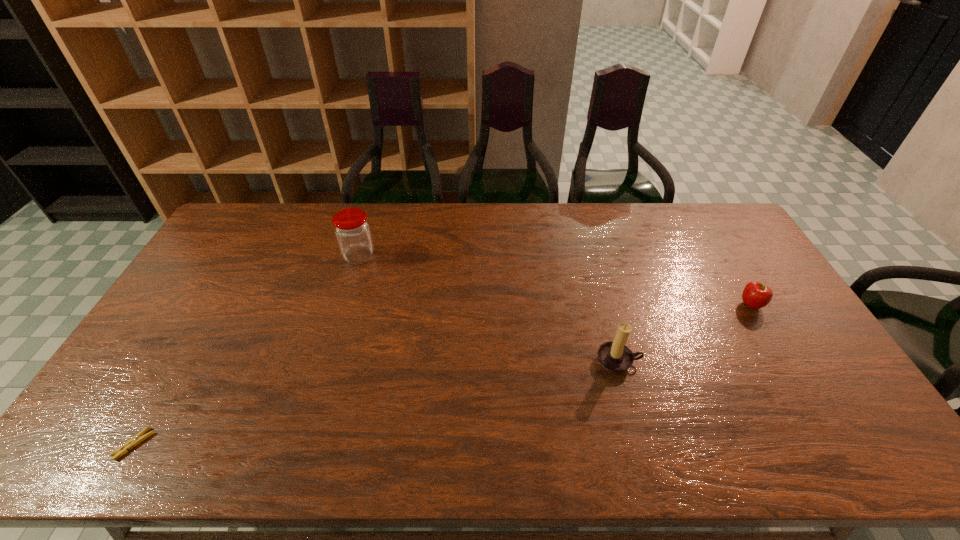
Locate an element on the screen. This screenshot has height=540, width=960. free region located 0.160m on the front of the second shortest object is located at coordinates (782, 357).

The image size is (960, 540). I want to click on vacant region located on the back of the clothespin, so click(x=166, y=388).

This screenshot has width=960, height=540. Identify the location of object that is positioned at the near edge. (138, 438).

You are a GUI agent. You are given a task and a screenshot of the screen. Output one action in this format:
    pyautogui.click(x=<x>, y=<y>)
    Task: Click on the object that is at the left edge
    The width and height of the screenshot is (960, 540).
    Given the screenshot: What is the action you would take?
    pyautogui.click(x=138, y=438)

Locate an element on the screen. Image resolution: width=960 pixels, height=540 pixels. object at the right edge is located at coordinates (755, 295).

Identify the location of object situated at the near left corner. This screenshot has height=540, width=960. (138, 438).

Find the location of a particular element. vacant space at the far edge of the desktop is located at coordinates (502, 217).

Where is `vacant space at the near edge of the desktop`? vacant space at the near edge of the desktop is located at coordinates (775, 442).

This screenshot has height=540, width=960. I want to click on vacant position at the left edge of the desktop, so click(182, 343).

Locate an element on the screen. This screenshot has width=960, height=540. free space at the far right corner is located at coordinates (709, 230).